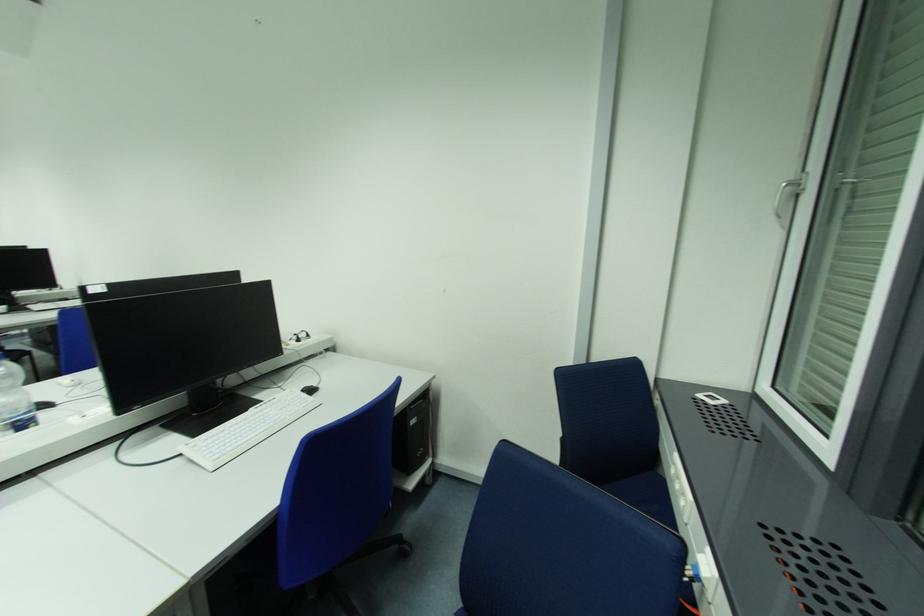
The location [247,429] corresponds to which object?

It corresponds to the white computer keyboard in the image.